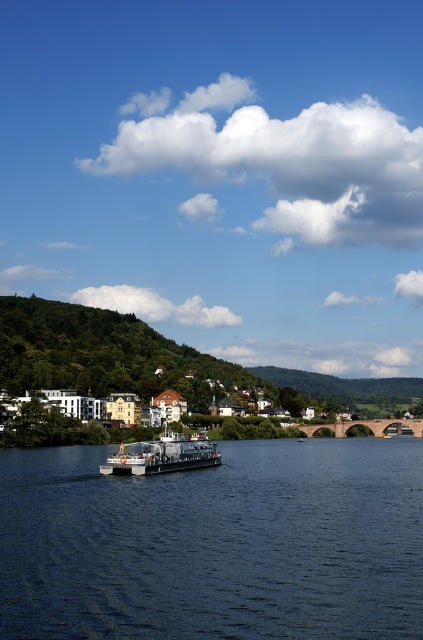
From the picture: You are a tourist standing on the riverside path and want to take a photo of the dark blue water at center and the white wooden houses at lower center. Based on their positions, which object should you frame first in your camera viewfinder to include both in the shot?

The dark blue water at center is positioned on the left side of white wooden houses at lower center, so you should frame the white wooden houses at lower center first on the right side of the viewfinder and then include the dark blue water at center on the left to capture both in the shot.

You are standing on the riverside and notice the dark blue water at center and the metallic gray ferry at center. Which object is nearer to you?

The dark blue water at center is closer to the viewer than the metallic gray ferry at center.